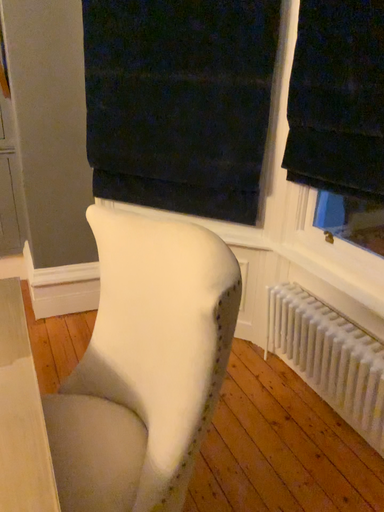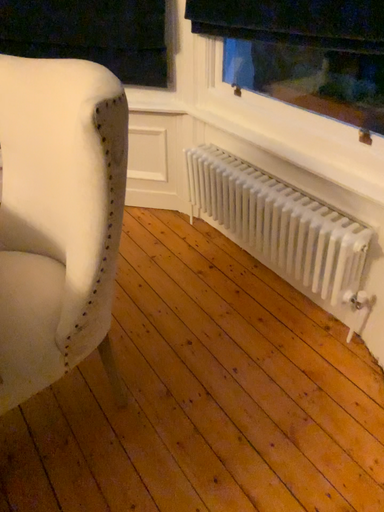
Question: How did the camera likely rotate when shooting the video?

Choices:
 (A) rotated downward
 (B) rotated upward

Answer: (A)